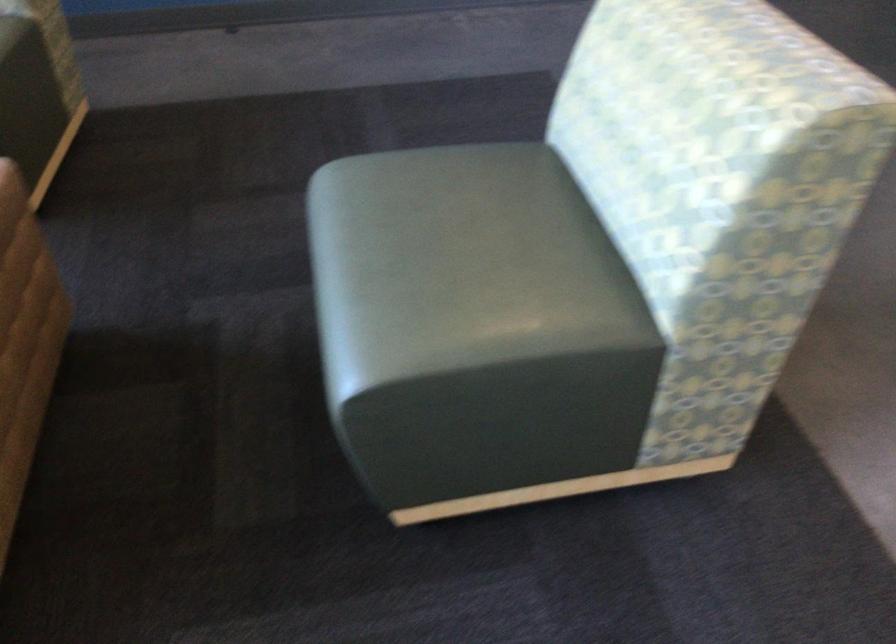
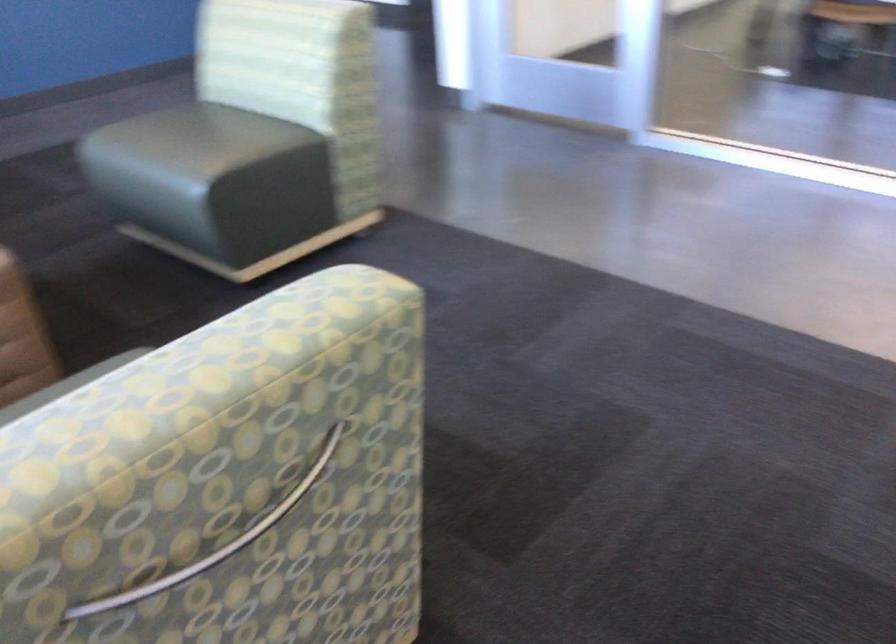
Locate, in the second image, the point that corresponds to pixel 419 243 in the first image.

(192, 143)